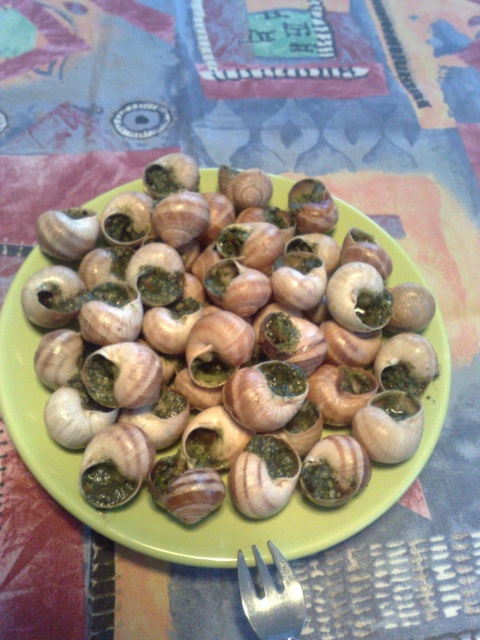
Is green matte snail at center thinner than silver metallic fork at bottom center?

Incorrect, green matte snail at center's width is not less than silver metallic fork at bottom center's.

Does green matte snail at center lie behind silver metallic fork at bottom center?

Yes, it is.

Which is behind, point (104, 244) or point (296, 634)?

The point (104, 244) is more distant.

Identify the location of green matte snail at center. The width and height of the screenshot is (480, 640). (218, 314).